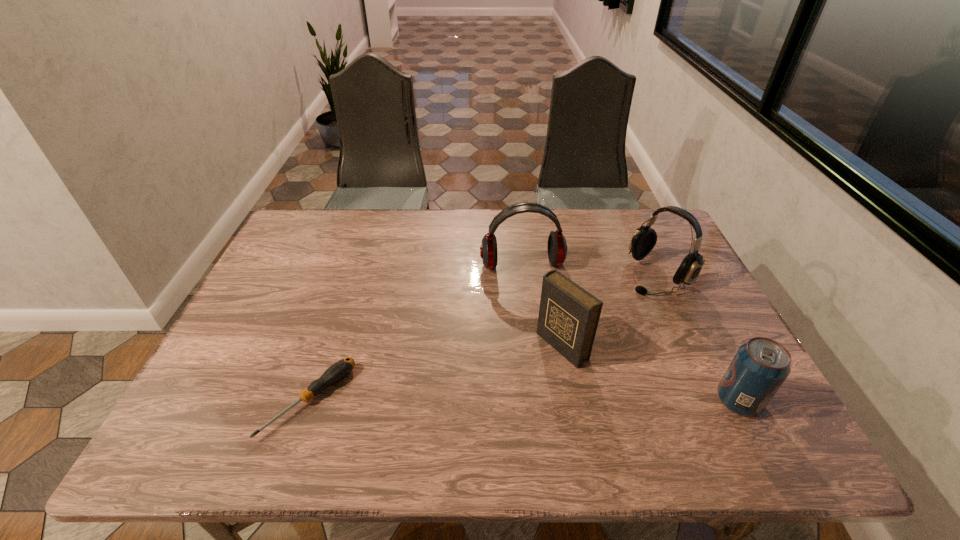
The width and height of the screenshot is (960, 540). I want to click on free space between the screwdriver and the pop soda, so click(x=524, y=401).

You are a GUI agent. You are given a task and a screenshot of the screen. Output one action in this format:
    pyautogui.click(x=<x>, y=<y>)
    Task: Click on the free space between the screwdriver and the headset
    Image resolution: width=960 pixels, height=540 pixels.
    Given the screenshot: What is the action you would take?
    pyautogui.click(x=484, y=338)

The width and height of the screenshot is (960, 540). In order to click on free point between the diary and the second shortest object in this screenshot , I will do `click(650, 374)`.

What are the coordinates of `free space between the headset and the diary` in the screenshot? It's located at (610, 310).

The image size is (960, 540). What are the coordinates of `free spot between the screwdriver and the diary` in the screenshot? It's located at (436, 373).

Identify the location of empty space that is in between the second shortest object and the headset. Image resolution: width=960 pixels, height=540 pixels. (698, 338).

Identify the location of free spot between the earphone and the second shortest object. (630, 333).

Identify the location of blank region between the headset and the fourth tallest object. Image resolution: width=960 pixels, height=540 pixels. (698, 338).

At what (x,y) coordinates should I click in order to perform the action: click on the third closest object to the headset. Please return your answer as a coordinate pair (x, y). The width and height of the screenshot is (960, 540). Looking at the image, I should click on click(x=759, y=368).

Locate an element on the screen. object that stands as the third closest to the earphone is located at coordinates (339, 370).